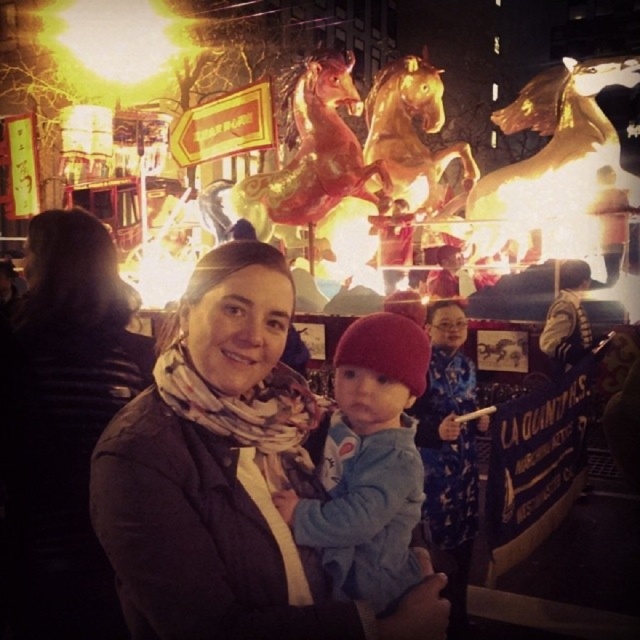
Which is above, matte scarf at center or dark gray sweater at center?

dark gray sweater at center

At what (x,y) coordinates should I click in order to perform the action: click on matte scarf at center. Please return your answer as a coordinate pair (x, y). This screenshot has width=640, height=640. Looking at the image, I should click on (227, 477).

You are a GUI agent. You are given a task and a screenshot of the screen. Output one action in this format:
    pyautogui.click(x=<x>, y=<y>)
    Task: Click on the matte scarf at center
    
    Given the screenshot: What is the action you would take?
    pyautogui.click(x=227, y=477)

Does matte scarf at center have a smaller size compared to blue fleece jacket at center?

Incorrect, matte scarf at center is not smaller in size than blue fleece jacket at center.

Who is shorter, matte scarf at center or blue fleece jacket at center?

blue fleece jacket at center is shorter.

Who is more distant from viewer, (232, 560) or (330, 476)?

Point (330, 476)

This screenshot has width=640, height=640. I want to click on matte scarf at center, so click(227, 477).

Who is positioned more to the left, dark gray sweater at center or blue fleece jacket at center?

dark gray sweater at center is more to the left.

Does dark gray sweater at center have a lesser height compared to blue fleece jacket at center?

No, dark gray sweater at center is not shorter than blue fleece jacket at center.

Which is in front, point (28, 589) or point (385, 401)?

Point (28, 589)

I want to click on dark gray sweater at center, so click(x=70, y=417).